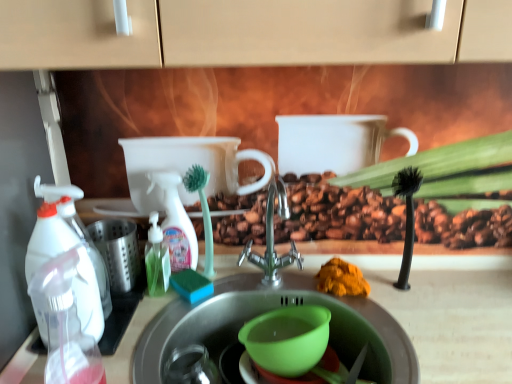
Find the location of a particular element. free space above stainless steel sink at center (from a real-world perspective) is located at coordinates (295, 295).